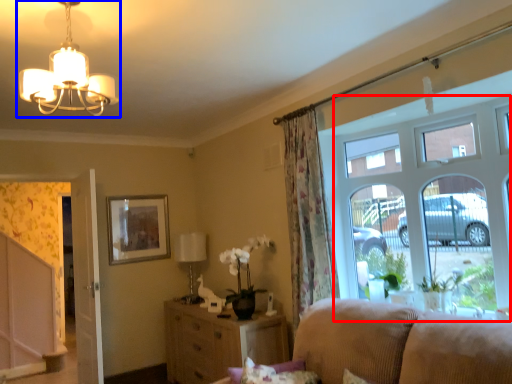
Question: Which object is closer to the camera taking this photo, window (highlighted by a red box) or lamp (highlighted by a blue box)?

Choices:
 (A) window
 (B) lamp

Answer: (B)